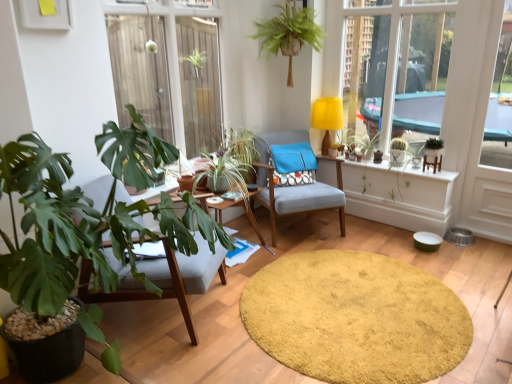
Question: Considering their positions, is green matte cactus at upper right, which appears as the 2th plant when viewed from the left, located in front of or behind yellow shaggy rug at center?

Choices:
 (A) front
 (B) behind

Answer: (B)

Question: From a real-world perspective, relative to yellow shaggy rug at center, is green matte cactus at upper right, which appears as the 2th plant when viewed from the left, vertically above or below?

Choices:
 (A) below
 (B) above

Answer: (B)

Question: Which of these objects is positioned closest to the woodenobject at center?

Choices:
 (A) yellow shaggy rug at center
 (B) green leafy plant at upper center, which is the third houseplant from right to left
 (C) green leafy plant at center, the 2th houseplant viewed from the left
 (D) green matte cactus at upper right, which appears as the 2th plant when viewed from the left
 (E) textured fabric chair at center, which is the first chair from back to front

Answer: (C)

Question: Which of these objects is positioned closest to the transparent glass window at upper left?

Choices:
 (A) green leafy plant at right, acting as the third houseplant starting from the front
 (B) blue fabric pillow at center
 (C) yellow fabric lampshade at upper center
 (D) green leafy plant at upper center, the 3th houseplant in the left-to-right sequence
 (E) yellow fabric at upper right

Answer: (D)